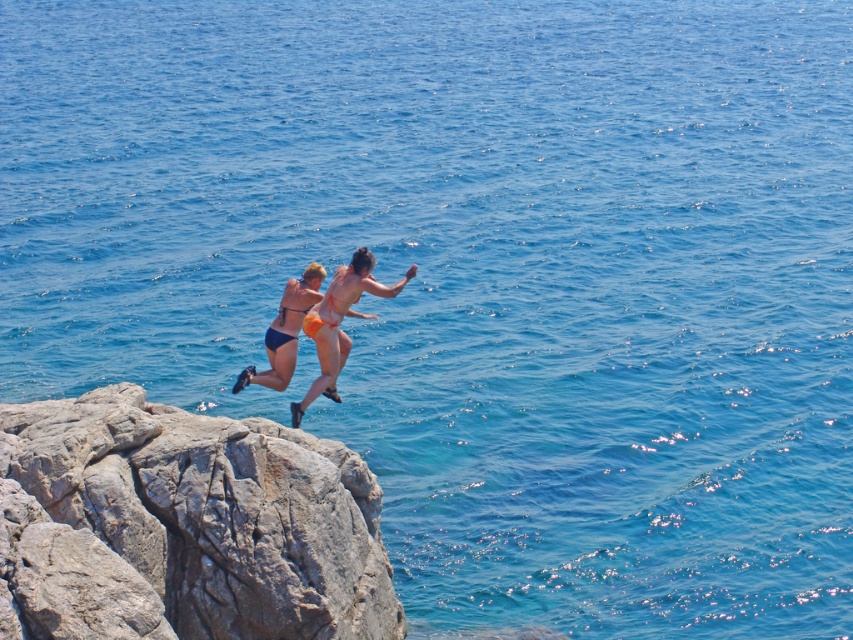
Which is behind, point (82, 609) or point (305, 326)?

The point (305, 326) is more distant.

Can you confirm if gray rough rock at left is wider than orange bikini at center?

Yes.

Measure the distance between point (373, 632) and camera.

They are 64.98 feet apart.

Locate an element on the screen. The width and height of the screenshot is (853, 640). gray rough rock at left is located at coordinates (183, 525).

Is point (152, 577) behind point (274, 385)?

No.

Between point (270, 429) and point (316, 276), which one is positioned behind?

Point (316, 276)

Who is more forward, (x=352, y=582) or (x=239, y=380)?

Point (x=352, y=582)

I want to click on gray rough rock at left, so click(183, 525).

Which is more to the left, orange bikini at center or matte blue bikini at center?

matte blue bikini at center

Is orange bikini at center taller than matte blue bikini at center?

Yes, orange bikini at center is taller than matte blue bikini at center.

Locate an element on the screen. orange bikini at center is located at coordinates (339, 323).